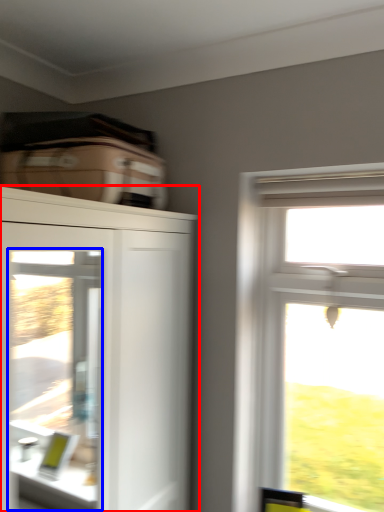
Question: Which point is further to the camera, cupboard (highlighted by a red box) or screen door (highlighted by a blue box)?

Choices:
 (A) cupboard
 (B) screen door

Answer: (B)